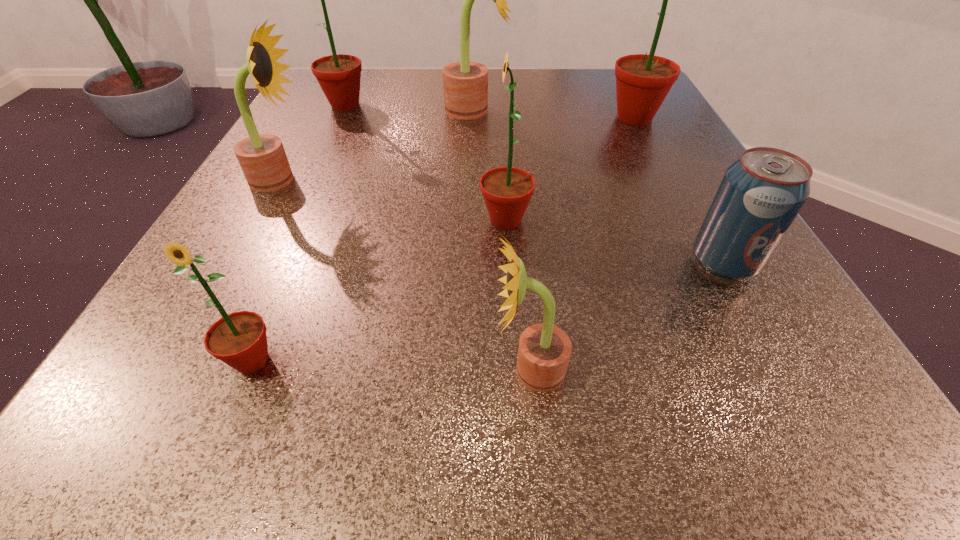
This screenshot has width=960, height=540. Find the location of `vacant space located on the face of the second smallest green sunflower`. vacant space located on the face of the second smallest green sunflower is located at coordinates (379, 220).

In order to click on free space located on the face of the smallest yellow sunflower in this screenshot , I will do `click(171, 370)`.

The height and width of the screenshot is (540, 960). Find the location of `vacant point located on the face of the smallest yellow sunflower`. vacant point located on the face of the smallest yellow sunflower is located at coordinates (383, 370).

The image size is (960, 540). I want to click on vacant space located 0.230m on the face of the smallest yellow sunflower, so click(x=282, y=370).

Identify the location of vacant space located 0.060m on the face of the nearest green sunflower. This screenshot has width=960, height=540. (219, 439).

The width and height of the screenshot is (960, 540). I want to click on vacant space situated on the back of the shortest object, so click(x=695, y=211).

This screenshot has width=960, height=540. I want to click on sunflower that is at the right edge, so click(x=643, y=81).

The image size is (960, 540). I want to click on pop soda located in the right edge section of the desktop, so click(x=761, y=193).

Find the location of `object located at the far left corner`. object located at the far left corner is located at coordinates (339, 76).

At what (x,y) coordinates should I click in order to perform the action: click on object that is at the near left corner. Please return your answer as a coordinate pair (x, y). Looking at the image, I should click on (239, 339).